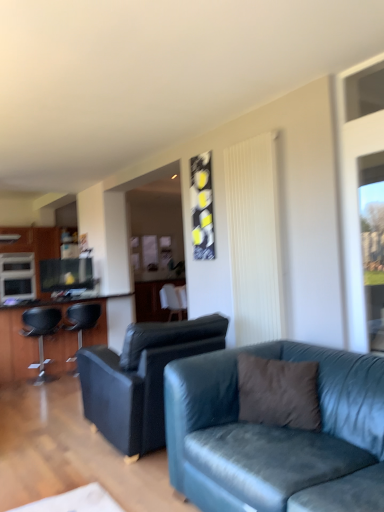
This screenshot has height=512, width=384. What do you see at coordinates (140, 378) in the screenshot?
I see `leather couch at center, the first studio couch positioned from the back` at bounding box center [140, 378].

Identify the location of matte black entertainment center at left. This screenshot has height=512, width=384. (39, 272).

The height and width of the screenshot is (512, 384). What do you see at coordinates (39, 272) in the screenshot?
I see `matte black entertainment center at left` at bounding box center [39, 272].

What is the approximate width of brown fuzzy pillow at center?

brown fuzzy pillow at center is 10.82 inches in width.

What is the approximate height of velvet blue couch at center, placed as the 2th studio couch when sorted from back to front?

The height of velvet blue couch at center, placed as the 2th studio couch when sorted from back to front, is 32.26 inches.

This screenshot has width=384, height=512. I want to click on velvet blue couch at center, placed as the 2th studio couch when sorted from back to front, so click(x=276, y=435).

You are a GUI agent. You are given a task and a screenshot of the screen. Output one action in this format:
    pyautogui.click(x=<x>, y=<y>)
    Task: Click on the satin silver microwave at left
    
    Given the screenshot: What is the action you would take?
    pyautogui.click(x=17, y=276)

Locate an element on the screen. This screenshot has width=384, height=512. white textured curtain at center is located at coordinates (254, 239).

This screenshot has height=512, width=384. Identify the location of leather couch at center, the second studio couch when ordered from front to back. (140, 378).

From the image's perspective, is white textured curtain at center on top of brown fuzzy pillow at center?

Indeed, from the image's perspective, white textured curtain at center is shown above brown fuzzy pillow at center.

Does white textured curtain at center have a larger size compared to brown fuzzy pillow at center?

Indeed, white textured curtain at center has a larger size compared to brown fuzzy pillow at center.

Considering the sizes of objects white textured curtain at center and brown fuzzy pillow at center in the image provided, who is wider, white textured curtain at center or brown fuzzy pillow at center?

brown fuzzy pillow at center is wider.

This screenshot has width=384, height=512. Find the location of `the 2nd chair in front of the matte black cabinet at left, starting your count from the anchor`. the 2nd chair in front of the matte black cabinet at left, starting your count from the anchor is located at coordinates pos(82,318).

Is black leather chair at left, placed as the second chair when sorted from right to left, positioned in front of matte black cabinet at left?

Yes, black leather chair at left, placed as the second chair when sorted from right to left, is closer to the camera.

Is black leather chair at left, the 2th chair when ordered from back to front, taller or shorter than matte black cabinet at left?

Clearly, black leather chair at left, the 2th chair when ordered from back to front, is shorter compared to matte black cabinet at left.

Is black leather chair at left, acting as the second chair starting from the left, next to matte black cabinet at left and touching it?

black leather chair at left, acting as the second chair starting from the left, and matte black cabinet at left are not in contact.

Does velvet blue couch at center, placed as the 2th studio couch when sorted from back to front, have a lesser width compared to matte black entertainment center at left?

Yes, velvet blue couch at center, placed as the 2th studio couch when sorted from back to front, is thinner than matte black entertainment center at left.

Could you measure the distance between velvet blue couch at center, placed as the 2th studio couch when sorted from back to front, and matte black entertainment center at left?

11.27 feet.

Does point (166, 399) come in front of point (78, 298)?

That is True.

Between velvet blue couch at center, placed as the 2th studio couch when sorted from back to front, and matte black entertainment center at left, which one has smaller size?

velvet blue couch at center, placed as the 2th studio couch when sorted from back to front.

How different are the orientations of white fabric chair at center, arranged as the 1th chair when viewed from the back, and matte black cabinet at left in degrees?

88.3 degrees.

Between white fabric chair at center, positioned as the third chair in left-to-right order, and matte black cabinet at left, which one has larger width?

matte black cabinet at left.

Is white fabric chair at center, arranged as the 1th chair when viewed from the back, turned away from matte black cabinet at left?

white fabric chair at center, arranged as the 1th chair when viewed from the back, does not have its back to matte black cabinet at left.

Identify the location of the 1st chair below the matte black cabinet at left (from the image's perspective). (173, 300).

From a real-world perspective, which object rests below the other?

In real-world perspective, black leather chair at left, placed as the second chair when sorted from front to back, is lower.

Does satin silver microwave at left have a lesser width compared to black leather chair at left, the 2th chair when ordered from back to front?

No.

From the image's perspective, between satin silver microwave at left and black leather chair at left, the 2th chair when ordered from back to front, who is located below?

black leather chair at left, the 2th chair when ordered from back to front.

Is the position of satin silver microwave at left more distant than that of black leather chair at left, acting as the second chair starting from the left?

That is True.

From the image's perspective, would you say brown fuzzy pillow at center is shown under matte black bar stool at left, placed as the 3th chair when sorted from right to left?

Incorrect, from the image's perspective, brown fuzzy pillow at center is higher than matte black bar stool at left, placed as the 3th chair when sorted from right to left.

Looking at this image, is brown fuzzy pillow at center not inside matte black bar stool at left, the 1th chair viewed from the left?

Yes.

The width and height of the screenshot is (384, 512). In order to click on pillow located above the matte black bar stool at left, the 1th chair viewed from the left (from the image's perspective) in this screenshot , I will do `click(278, 392)`.

Does brown fuzzy pillow at center have a greater width compared to matte black bar stool at left, the 1th chair viewed from the left?

No, brown fuzzy pillow at center is not wider than matte black bar stool at left, the 1th chair viewed from the left.

Is point (305, 428) positioned behind point (131, 349)?

No, (305, 428) is in front of (131, 349).

From the image's perspective, is brown fuzzy pillow at center located beneath leather couch at center, the second studio couch when ordered from front to back?

Incorrect, from the image's perspective, brown fuzzy pillow at center is higher than leather couch at center, the second studio couch when ordered from front to back.

How many degrees apart are the facing directions of brown fuzzy pillow at center and leather couch at center, the first studio couch positioned from the back?

123 degrees separate the facing orientations of brown fuzzy pillow at center and leather couch at center, the first studio couch positioned from the back.

Relative to leather couch at center, the first studio couch positioned from the back, is brown fuzzy pillow at center in front or behind?

In the image, brown fuzzy pillow at center appears in front of leather couch at center, the first studio couch positioned from the back.

Identify the location of pillow that appears below the white textured curtain at center (from a real-world perspective). The height and width of the screenshot is (512, 384). (278, 392).

What are the coordinates of `the 2nd chair below when counting from the matte black cabinet at left (from the image's perspective)` in the screenshot? It's located at 82,318.

Looking at the image, which one is located closer to satin silver microwave at left, matte black cabinet at left or brown fuzzy pillow at center?

matte black cabinet at left lies closer to satin silver microwave at left than the other object.

When comparing their distances from matte black entertainment center at left, does black leather chair at left, acting as the second chair starting from the left, or brown fuzzy pillow at center seem closer?

black leather chair at left, acting as the second chair starting from the left, is closer to matte black entertainment center at left.

Considering their positions, is velvet blue couch at center, marked as the 1th studio couch in a front-to-back arrangement, positioned closer to leather couch at center, the first studio couch positioned from the back, than matte black cabinet at left?

The object closer to leather couch at center, the first studio couch positioned from the back, is velvet blue couch at center, marked as the 1th studio couch in a front-to-back arrangement.

Estimate the real-world distances between objects in this image. Which object is further from white fabric chair at center, the 3th chair positioned from the front, brown fuzzy pillow at center or velvet blue couch at center, marked as the 1th studio couch in a front-to-back arrangement?

Among the two, velvet blue couch at center, marked as the 1th studio couch in a front-to-back arrangement, is located further to white fabric chair at center, the 3th chair positioned from the front.

Considering their positions, is matte black bar stool at left, the 1th chair viewed from the left, positioned further to brown fuzzy pillow at center than matte black entertainment center at left?

matte black entertainment center at left lies further to brown fuzzy pillow at center than the other object.

Estimate the real-world distances between objects in this image. Which object is further from velvet blue couch at center, marked as the 1th studio couch in a front-to-back arrangement, matte black bar stool at left, the third chair in the back-to-front sequence, or transparent glass window at right?

matte black bar stool at left, the third chair in the back-to-front sequence.

Based on their spatial positions, is brown fuzzy pillow at center or transparent glass window at right closer to white fabric chair at center, positioned as the third chair in left-to-right order?

Among the two, transparent glass window at right is located nearer to white fabric chair at center, positioned as the third chair in left-to-right order.

Considering their positions, is brown fuzzy pillow at center positioned further to leather couch at center, the first studio couch positioned from the back, than white fabric chair at center, the 3th chair positioned from the front?

white fabric chair at center, the 3th chair positioned from the front, is further to leather couch at center, the first studio couch positioned from the back.

This screenshot has height=512, width=384. What are the coordinates of `curtain situated between matte black bar stool at left, the 1th chair viewed from the left, and transparent glass window at right from left to right` in the screenshot? It's located at (254, 239).

I want to click on curtain between velvet blue couch at center, placed as the 2th studio couch when sorted from back to front, and matte black bar stool at left, marked as the first chair in a front-to-back arrangement, from front to back, so click(254, 239).

The width and height of the screenshot is (384, 512). I want to click on curtain positioned between velvet blue couch at center, marked as the 1th studio couch in a front-to-back arrangement, and white fabric chair at center, arranged as the 1th chair when viewed from the back, from near to far, so click(254, 239).

Where is `curtain positioned between brown fuzzy pillow at center and matte black cabinet at left from near to far`? curtain positioned between brown fuzzy pillow at center and matte black cabinet at left from near to far is located at coordinates (254, 239).